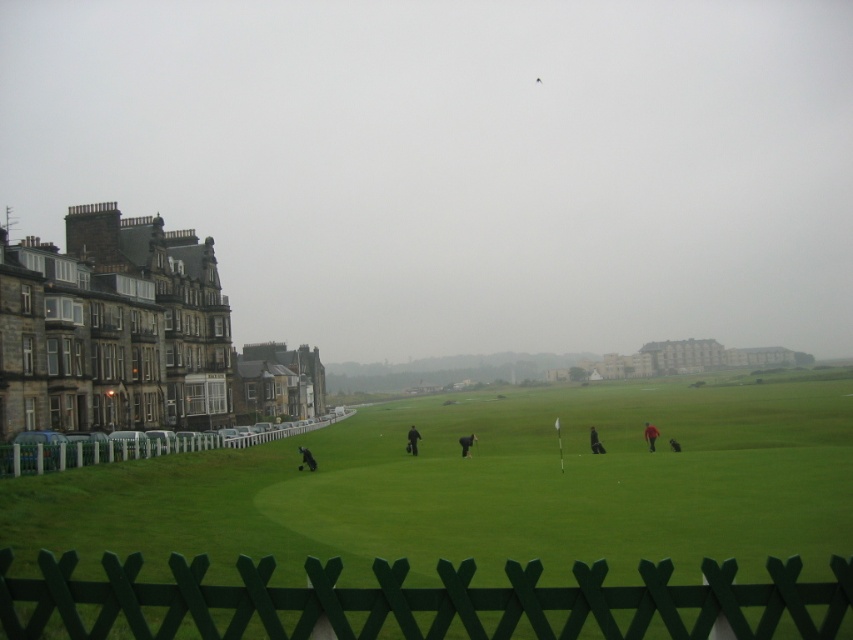
Question: Which object is the closest to the black matte golf bag at center?

Choices:
 (A) green grass at center
 (B) dark gray jacket at center

Answer: (B)

Question: Which point appears closest to the camera in this image?

Choices:
 (A) (19, 566)
 (B) (473, 435)
 (C) (590, 448)

Answer: (A)

Question: Is black matte golf bag at center smaller than dark gray jacket at center?

Choices:
 (A) no
 (B) yes

Answer: (A)

Question: Is green grass at center bigger than dark gray jacket at center?

Choices:
 (A) yes
 (B) no

Answer: (A)

Question: Does green grass at center appear on the right side of dark gray jacket at center?

Choices:
 (A) yes
 (B) no

Answer: (A)

Question: Estimate the real-world distances between objects in this image. Which object is farther from the green wooden fence at left?

Choices:
 (A) black matte golf bag at center
 (B) green wooden fence at lower center
 (C) green grass at center
 (D) dark gray fabric person at center

Answer: (C)